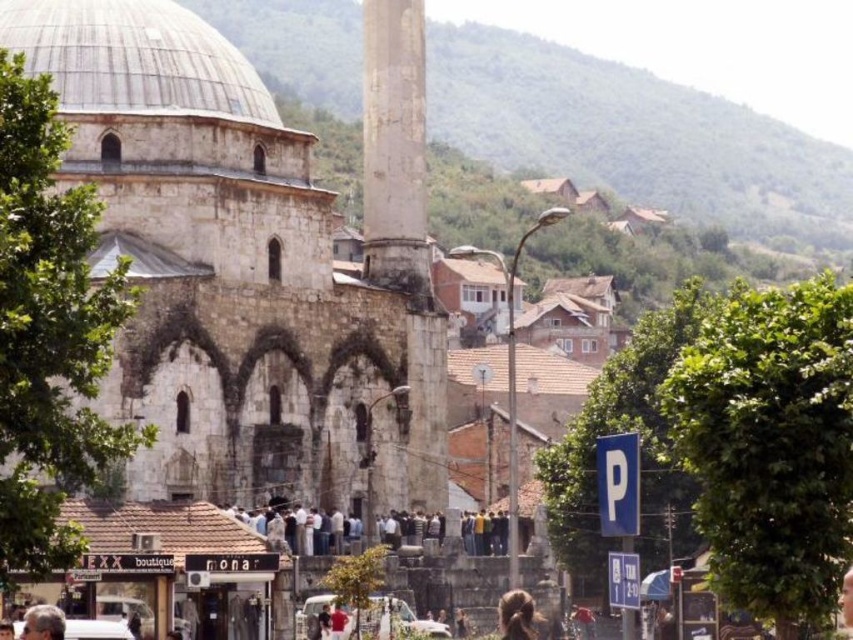
Is gray stone minaret at center thinner than gray stone dome at upper center?

Indeed, gray stone minaret at center has a lesser width compared to gray stone dome at upper center.

You are a GUI agent. You are given a task and a screenshot of the screen. Output one action in this format:
    pyautogui.click(x=<x>, y=<y>)
    Task: Click on the gray stone minaret at center
    This screenshot has width=853, height=640.
    Given the screenshot: What is the action you would take?
    pyautogui.click(x=404, y=227)

Between point (422, 406) and point (190, 67), which one is positioned behind?

The point (422, 406) is behind.

At what (x,y) coordinates should I click in order to perform the action: click on gray stone minaret at center. Please return your answer as a coordinate pair (x, y). This screenshot has height=640, width=853. Looking at the image, I should click on (404, 227).

Is dark gray stone people at center taller than brown fuzzy hair at lower center?

In fact, dark gray stone people at center may be shorter than brown fuzzy hair at lower center.

Does point (236, 518) come in front of point (515, 595)?

No, it is not.

Locate an element on the screen. dark gray stone people at center is located at coordinates pos(264,516).

Is gray stone dome at upper center further to camera compared to dark gray stone people at center?

Yes, gray stone dome at upper center is further from the viewer.

Which of these two, gray stone dome at upper center or dark gray stone people at center, stands taller?

With more height is gray stone dome at upper center.

Find the location of a particular element. gray stone dome at upper center is located at coordinates point(135,58).

Where is `gray stone dome at upper center`? This screenshot has width=853, height=640. gray stone dome at upper center is located at coordinates (135, 58).